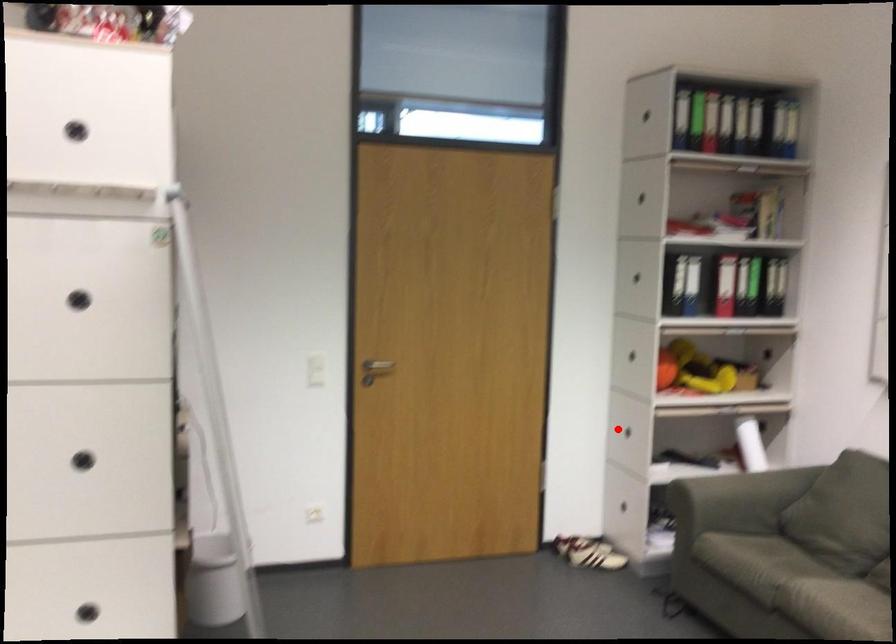
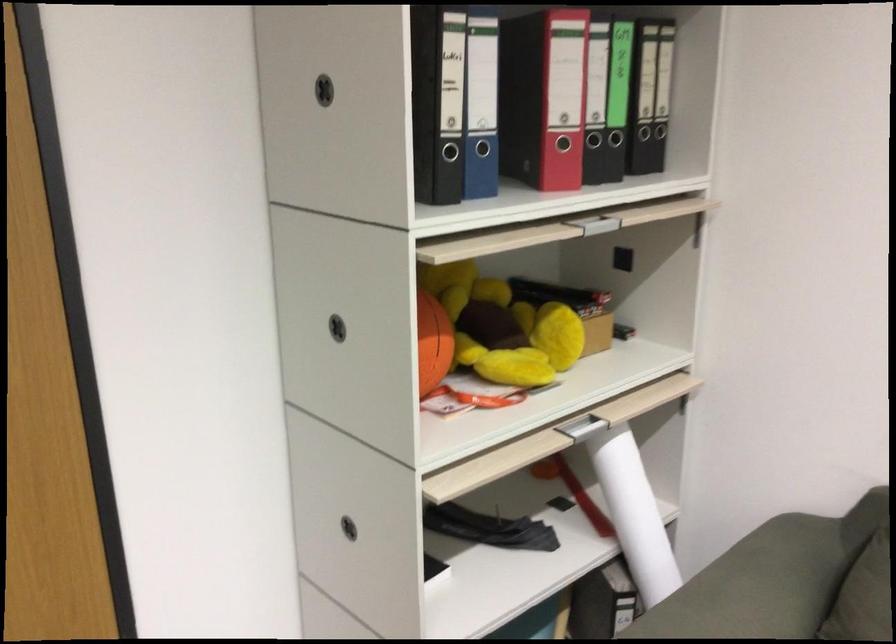
Find the pixel in the second image that matches the highlighted location in the first image.

(348, 527)